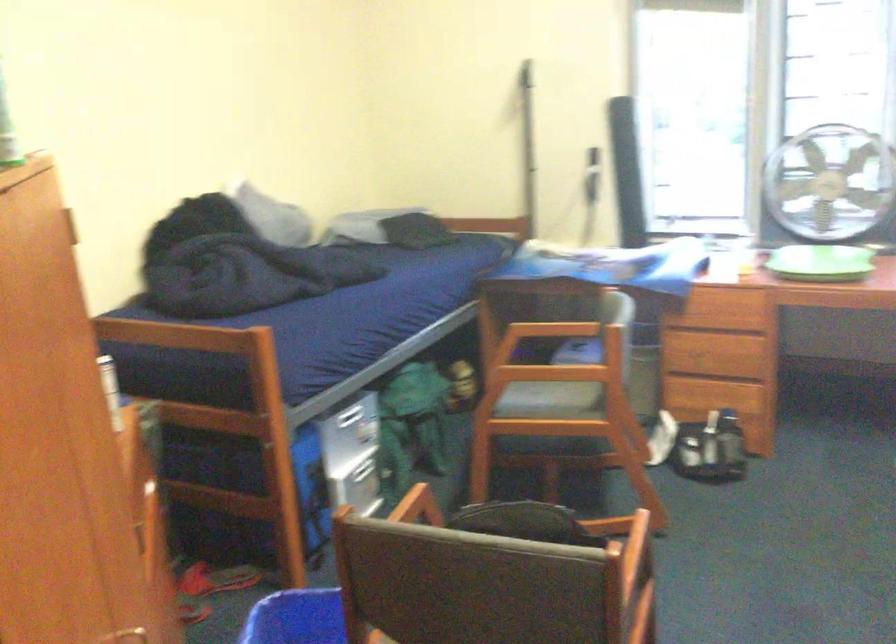
Where is `green circular tray`? The height and width of the screenshot is (644, 896). green circular tray is located at coordinates (821, 263).